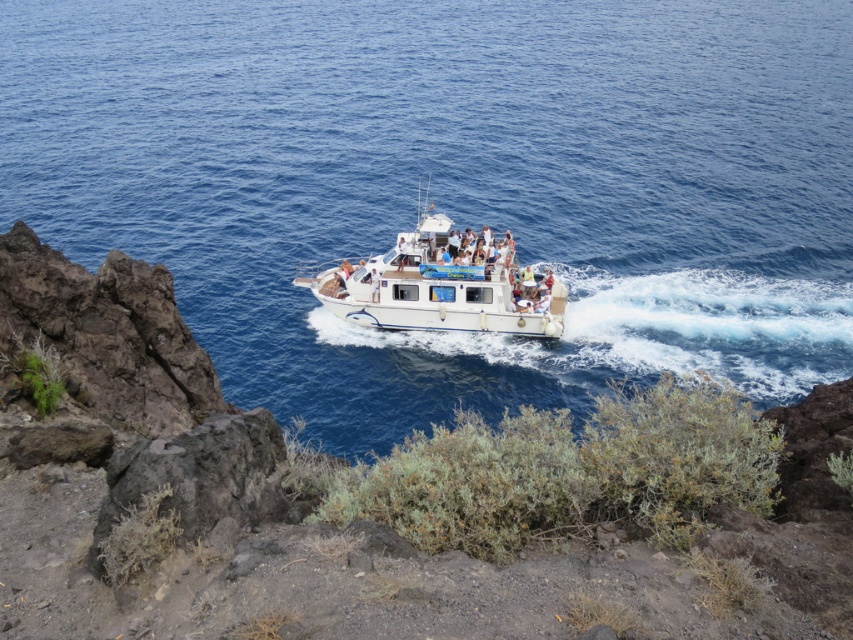
Question: Is blue water at center bigger than white glossy boat at center?

Choices:
 (A) yes
 (B) no

Answer: (A)

Question: In this image, where is blue water at center located relative to white glossy boat at center?

Choices:
 (A) above
 (B) below

Answer: (A)

Question: Can you confirm if blue water at center is wider than white glossy boat at center?

Choices:
 (A) no
 (B) yes

Answer: (B)